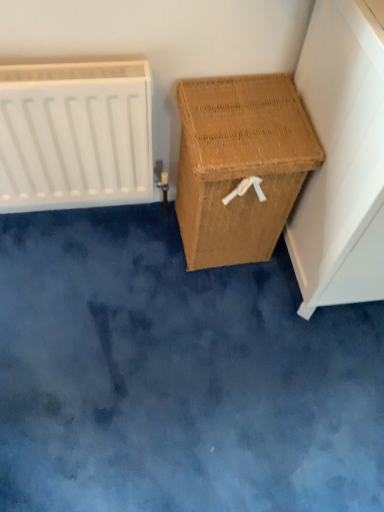
Question: Would you say woven brown basket at right, which is counted as the first furniture, starting from the left, is inside or outside white matte radiator at left?

Choices:
 (A) outside
 (B) inside

Answer: (A)

Question: Would you say woven brown basket at right, marked as the second furniture in a right-to-left arrangement, is to the left or to the right of white matte radiator at left in the picture?

Choices:
 (A) right
 (B) left

Answer: (A)

Question: Based on their relative distances, which object is farther from the woven brown basket at right, marked as the second furniture in a right-to-left arrangement?

Choices:
 (A) woven brown laundry basket at right, which is the second furniture in left-to-right order
 (B) white matte radiator at left

Answer: (B)

Question: Considering the real-world distances, which object is farthest from the white matte radiator at left?

Choices:
 (A) woven brown basket at right, which is counted as the first furniture, starting from the left
 (B) woven brown laundry basket at right, the 1th furniture in the right-to-left sequence

Answer: (B)